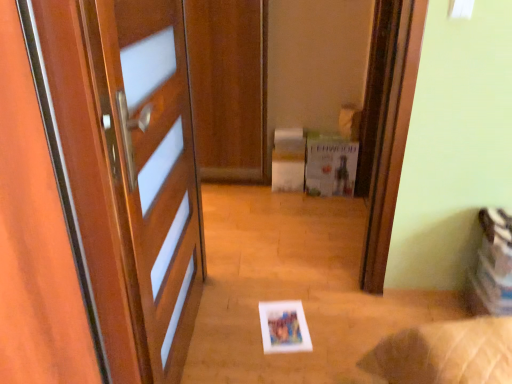
Measure the distance between point (370, 212) and camera.

A distance of 6.71 feet exists between point (370, 212) and camera.

Where is `transparent glass screen door at upper center`? transparent glass screen door at upper center is located at coordinates (392, 136).

What is the approximate width of transparent glass screen door at upper center?

transparent glass screen door at upper center is 6.35 centimeters in width.

The height and width of the screenshot is (384, 512). What do you see at coordinates (392, 136) in the screenshot?
I see `transparent glass screen door at upper center` at bounding box center [392, 136].

Image resolution: width=512 pixels, height=384 pixels. What do you see at coordinates (330, 166) in the screenshot?
I see `white paper postcard at center` at bounding box center [330, 166].

What is the approximate height of white paper postcard at center?

Result: The height of white paper postcard at center is 16.39 inches.

You are a GUI agent. You are given a task and a screenshot of the screen. Output one action in this format:
    pyautogui.click(x=<x>, y=<y>)
    Task: Click on the white paper postcard at center
    
    Given the screenshot: What is the action you would take?
    [x=330, y=166]

Image resolution: width=512 pixels, height=384 pixels. I want to click on transparent glass screen door at upper center, so click(392, 136).

Considering the positions of objects white paper postcard at center and transparent glass screen door at upper center in the image provided, who is more to the right, white paper postcard at center or transparent glass screen door at upper center?

transparent glass screen door at upper center.

Between white paper postcard at center and transparent glass screen door at upper center, which one is positioned behind?

Positioned behind is white paper postcard at center.

Which is closer to the camera, (354, 148) or (396, 40)?

The point (396, 40) is closer to the camera.

From the image's perspective, which object appears higher, white paper postcard at center or transparent glass screen door at upper center?

transparent glass screen door at upper center appears higher in the image.

From a real-world perspective, is white paper postcard at center positioned under transparent glass screen door at upper center based on gravity?

Correct, in the physical world, white paper postcard at center is lower than transparent glass screen door at upper center.

Between white paper postcard at center and transparent glass screen door at upper center, which one has larger width?

Wider between the two is white paper postcard at center.

Considering the sizes of objects white paper postcard at center and transparent glass screen door at upper center in the image provided, who is shorter, white paper postcard at center or transparent glass screen door at upper center?

white paper postcard at center is shorter.

Can you confirm if white paper postcard at center is smaller than transparent glass screen door at upper center?

Result: Yes, white paper postcard at center is smaller than transparent glass screen door at upper center.

Is transparent glass screen door at upper center located within white paper postcard at center?

No.

Is white paper postcard at center in contact with transparent glass screen door at upper center?

No, white paper postcard at center is not touching transparent glass screen door at upper center.

Does white paper postcard at center turn towards transparent glass screen door at upper center?

No, white paper postcard at center does not turn towards transparent glass screen door at upper center.

Where is `screen door in front of the white paper postcard at center`? This screenshot has height=384, width=512. screen door in front of the white paper postcard at center is located at coordinates (392, 136).

Which is more to the right, transparent glass screen door at upper center or white paper postcard at center?

Positioned to the right is transparent glass screen door at upper center.

Which object is further away from the camera, transparent glass screen door at upper center or white paper postcard at center?

white paper postcard at center is further away from the camera.

Does point (385, 84) come closer to viewer compared to point (353, 160)?

Yes, point (385, 84) is closer to viewer.

From the image's perspective, would you say transparent glass screen door at upper center is positioned over white paper postcard at center?

Yes, from the image's perspective, transparent glass screen door at upper center is on top of white paper postcard at center.

From a real-world perspective, which is physically above, transparent glass screen door at upper center or white paper postcard at center?

transparent glass screen door at upper center is physically above.

Considering the sizes of objects transparent glass screen door at upper center and white paper postcard at center in the image provided, who is thinner, transparent glass screen door at upper center or white paper postcard at center?

With smaller width is transparent glass screen door at upper center.

Between transparent glass screen door at upper center and white paper postcard at center, which one has more height?

transparent glass screen door at upper center is taller.

Which of these two, transparent glass screen door at upper center or white paper postcard at center, is smaller?

Smaller between the two is white paper postcard at center.

Consider the image. Choose the correct answer: Is transparent glass screen door at upper center inside white paper postcard at center or outside it?

transparent glass screen door at upper center is outside white paper postcard at center.

Would you say transparent glass screen door at upper center is a long distance from white paper postcard at center?

transparent glass screen door at upper center is positioned a significant distance from white paper postcard at center.

Could you tell me if transparent glass screen door at upper center is facing white paper postcard at center?

Yes, transparent glass screen door at upper center is turned towards white paper postcard at center.

This screenshot has height=384, width=512. I want to click on postcard below the transparent glass screen door at upper center (from a real-world perspective), so click(x=330, y=166).

Where is `postcard below the transparent glass screen door at upper center (from the image's perspective)`? postcard below the transparent glass screen door at upper center (from the image's perspective) is located at coordinates (330, 166).

Find the location of a particular element. The height and width of the screenshot is (384, 512). screen door located above the white paper postcard at center (from a real-world perspective) is located at coordinates (392, 136).